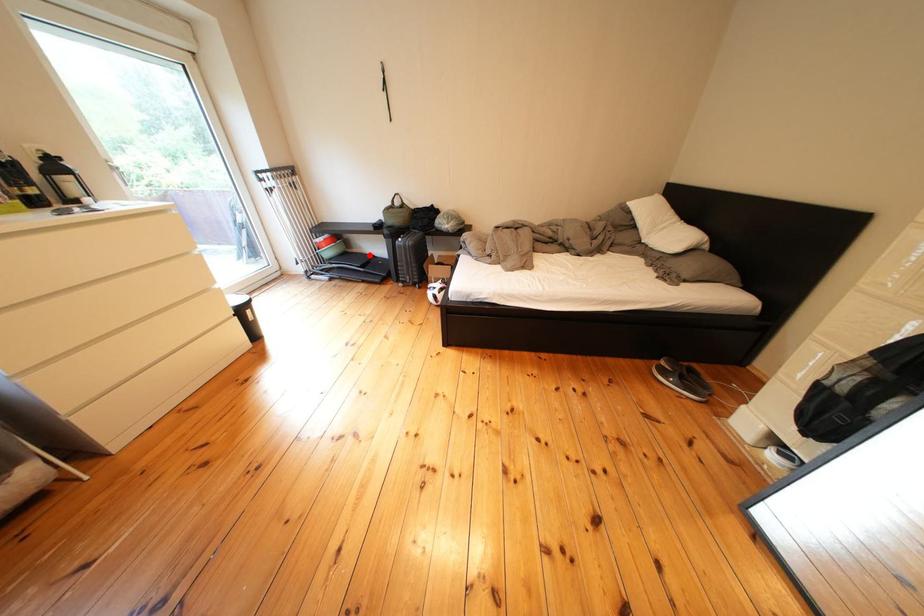
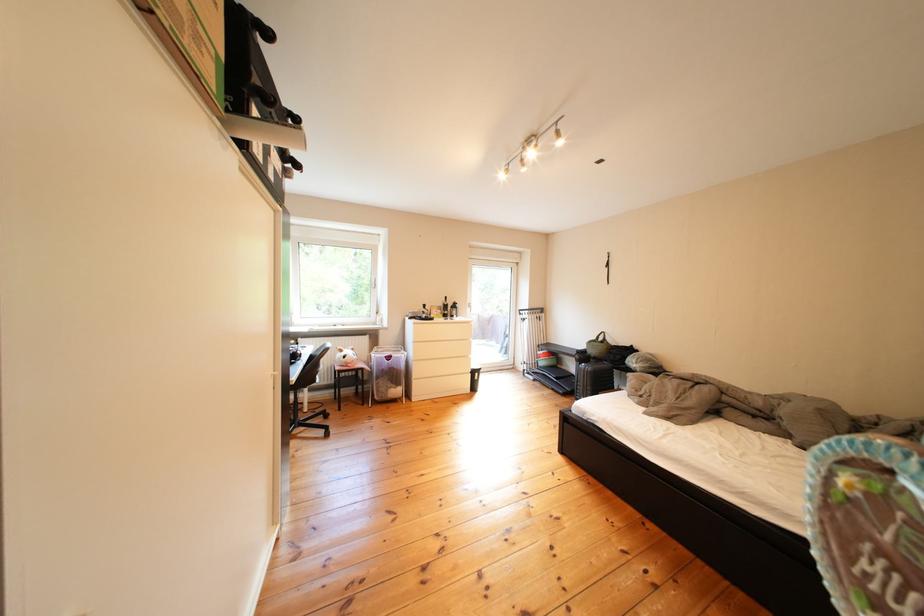
Question: A red point is marked in image1. In image2, is the corresponding 3D point closer to the camera or farther? Reply with the corresponding letter.

Choices:
 (A) The corresponding 3D point is closer.
 (B) The corresponding 3D point is farther.

Answer: (B)